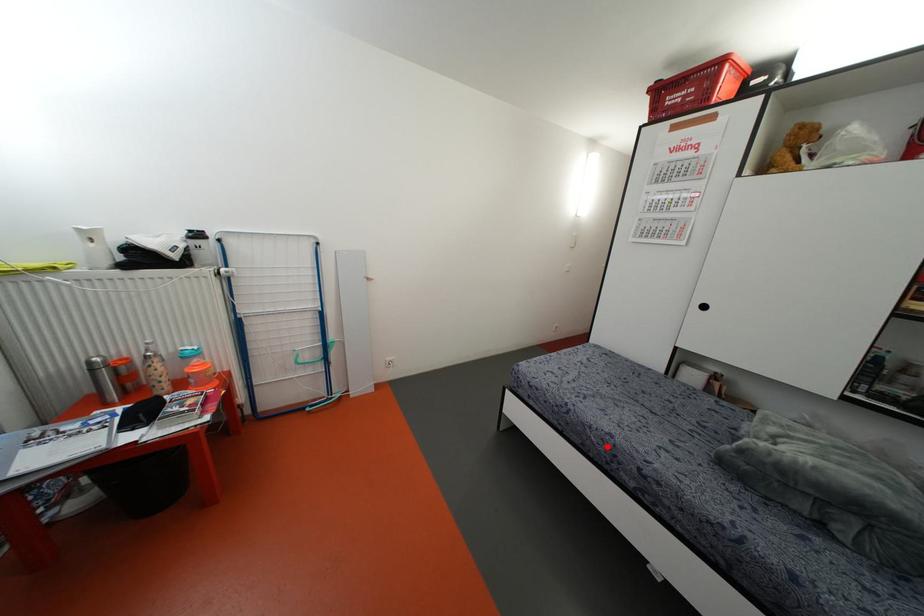
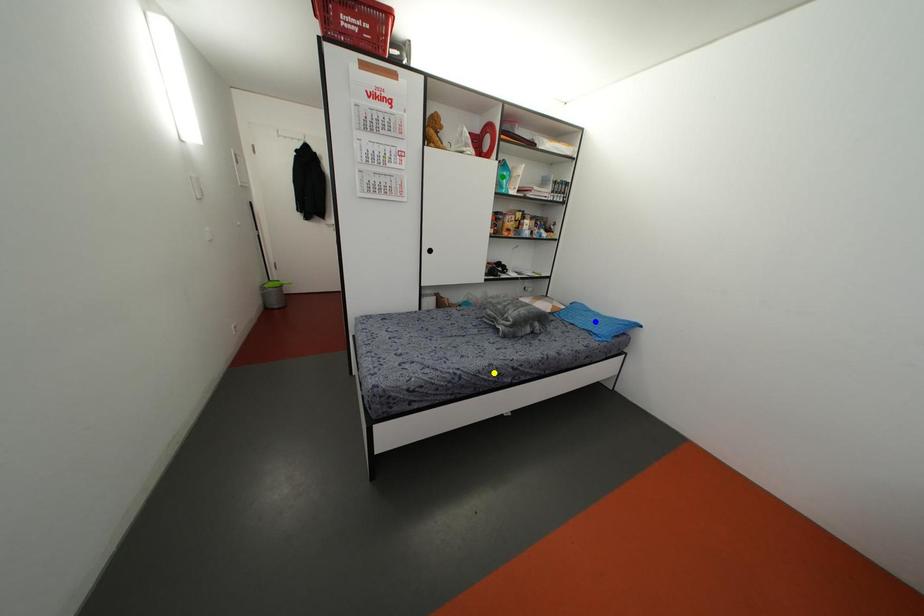
Question: I am providing you with two images of the same scene from different viewpoints. A red point is marked on the first image. You are given multiple points on the second image. Which point in image 2 represents the same 3d spot as the red point in image 1?

Choices:
 (A) green point
 (B) blue point
 (C) yellow point

Answer: (C)